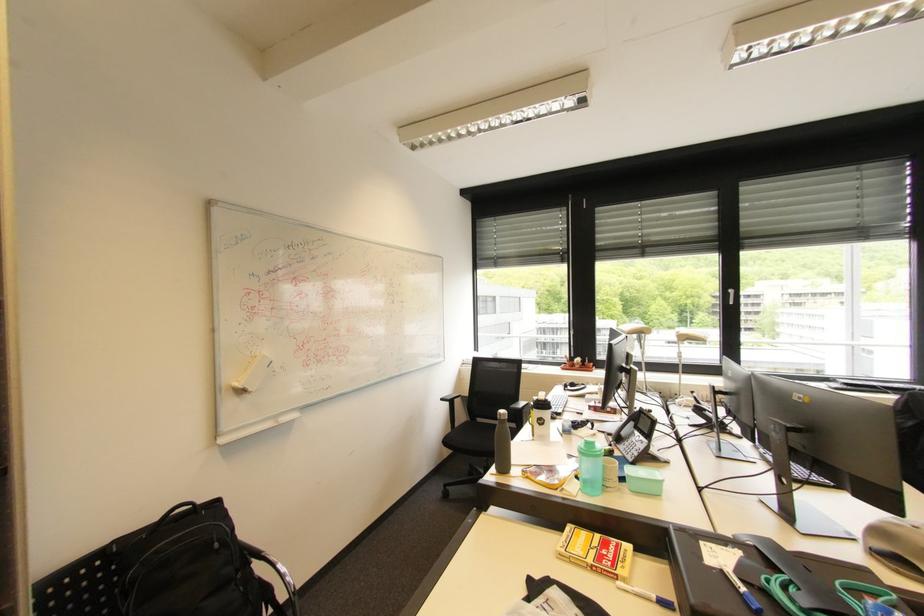
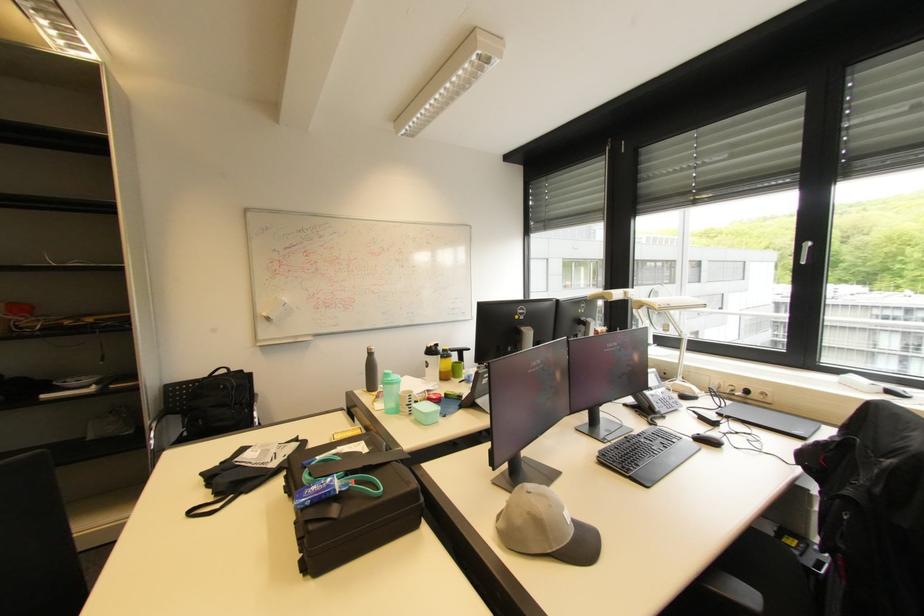
The point at (247,392) is marked in the first image. Where is the corresponding point in the second image?

(273, 320)